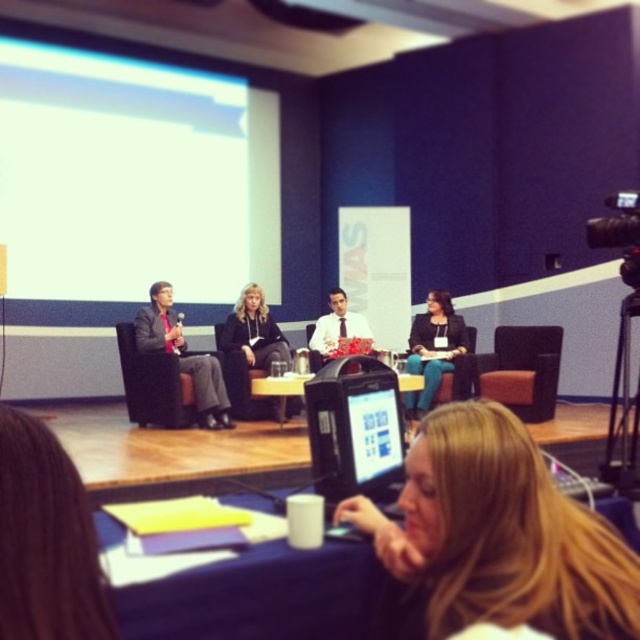
You are a technician setting up for a live stream. You have a matte black laptop at center and a camera that needs to be positioned at a specific distance. According to the setup guidelines, the camera must be placed exactly 5 feet away from the laptop. Can you confirm if the current placement meets the requirement?

The matte black laptop at center and camera are 5.03 feet apart from each other, which is slightly more than the required 5 feet. Therefore, the camera is positioned just beyond the specified distance and may need to be moved closer to meet the exact requirement.

You are an event organizer who needs to place a name tag on the table for the participant with blonde hair at lower right. Can you confirm if there is enough space on the blue fabric table at lower center to place the name tag without overlapping?

The blue fabric table at lower center is larger in size than blonde hair at lower right, so there is sufficient space to place the name tag without overlapping.